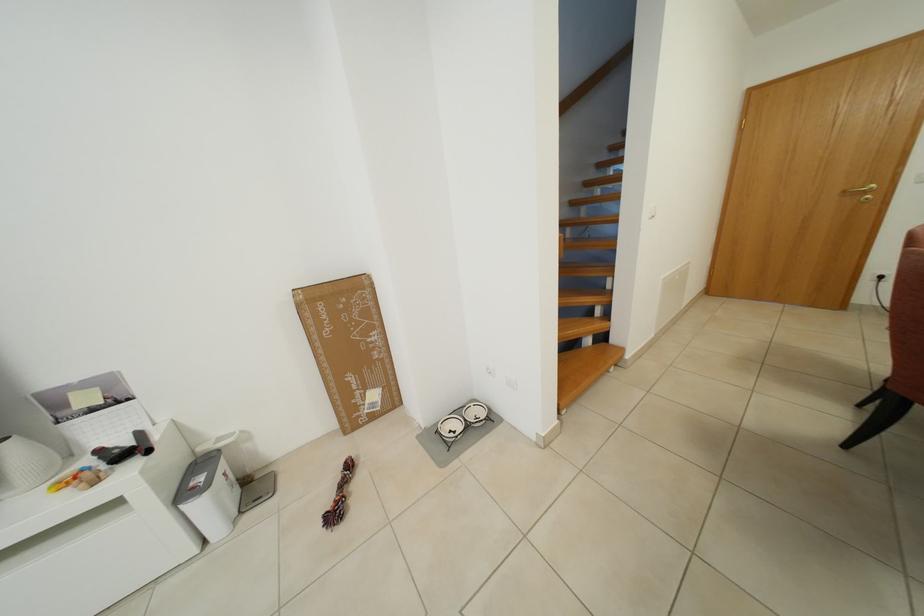
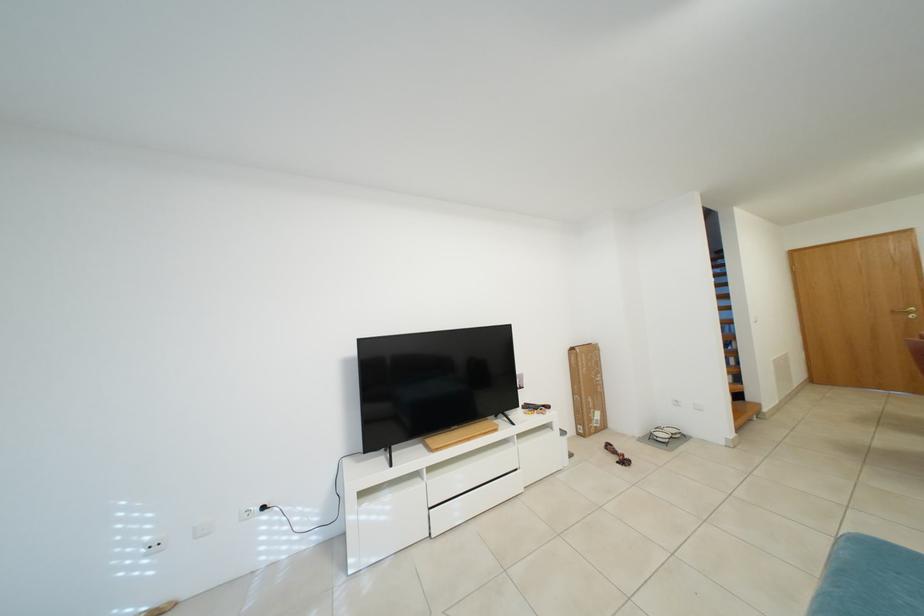
In a continuous first-person perspective shot, in which direction is the camera moving?

The movement direction of the cameraman is left, backward.